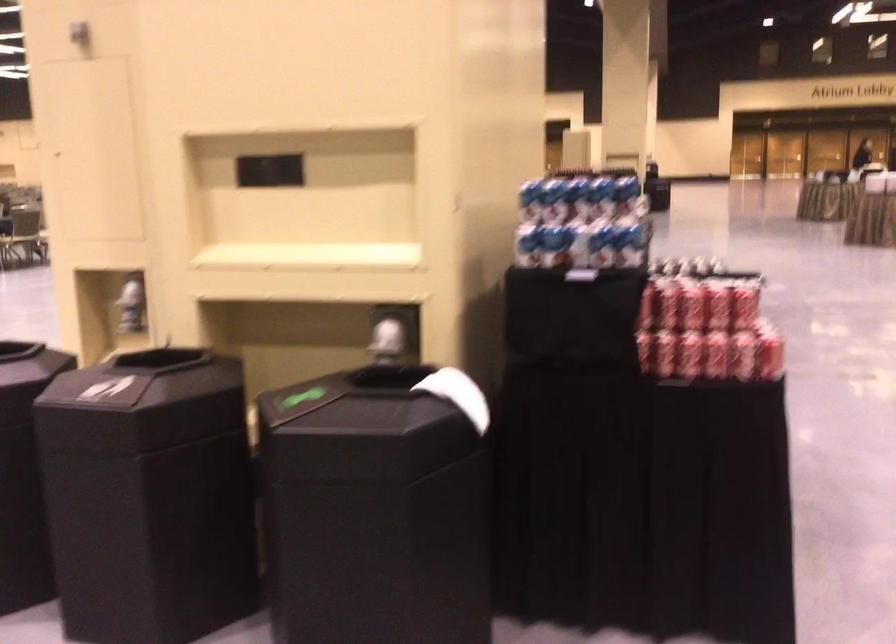
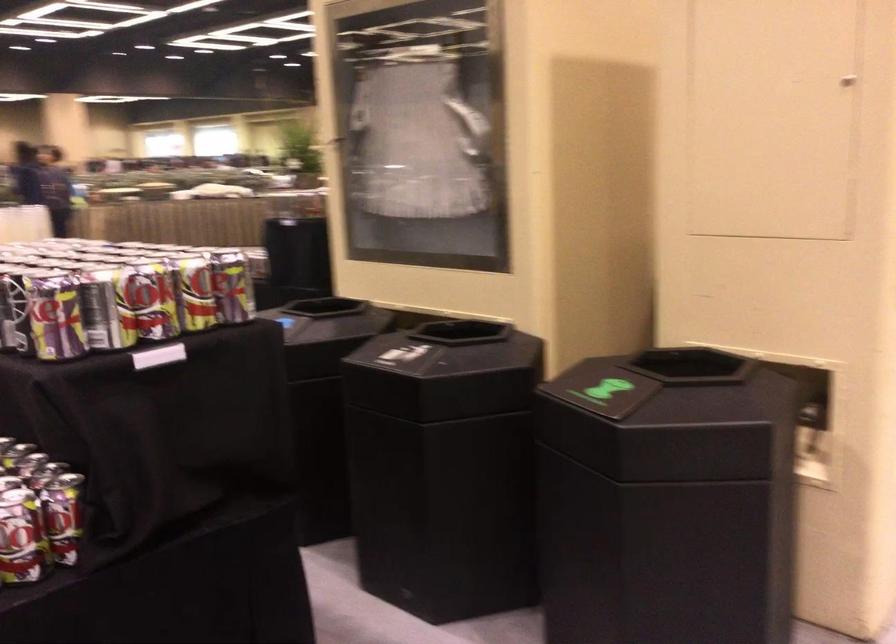
Question: I am providing you with two images of the same scene from different viewpoints. Please identify which objects are invisible in image2.

Choices:
 (A) black bin opening
 (B) red soda can
 (C) red and black backpack
 (D) beverage can

Answer: (B)